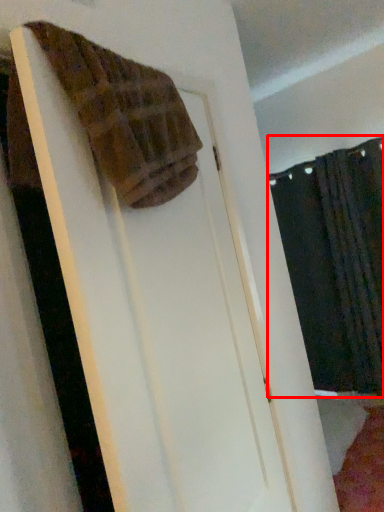
Question: Where is curtain (annotated by the red box) located in relation to towel in the image?

Choices:
 (A) left
 (B) right

Answer: (B)